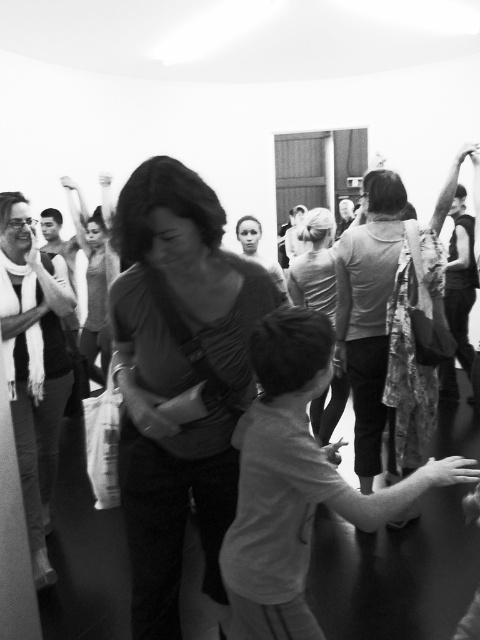
You are designing a layout for a magazine cover and need to place a photo of a white matte shirt at center and a smooth skin woman at center. Based on the image description, which object should be placed first to ensure proper alignment?

The white matte shirt at center might be wider than the smooth skin woman at center, so it should be placed first to ensure proper alignment.

Looking at this image, you are designing a layout for a magazine article about the photograph. The article requires placing a caption box next to the matte gray shirt at center and the smooth skin woman at center. Given their sizes in the image, which object should the caption box be placed closer to, and why?

The caption box should be placed closer to the smooth skin woman at center because the matte gray shirt at center is larger in size, so the woman herself is smaller and the caption needs to be near her for clarity.

You are organizing a clothing donation drive and need to categorize shirts by size. You have two shirts in front of you, a white matte shirt at center and a matte black shirt at center. Which shirt has a larger width?

The white matte shirt at center has a larger width than the matte black shirt at center according to the description.